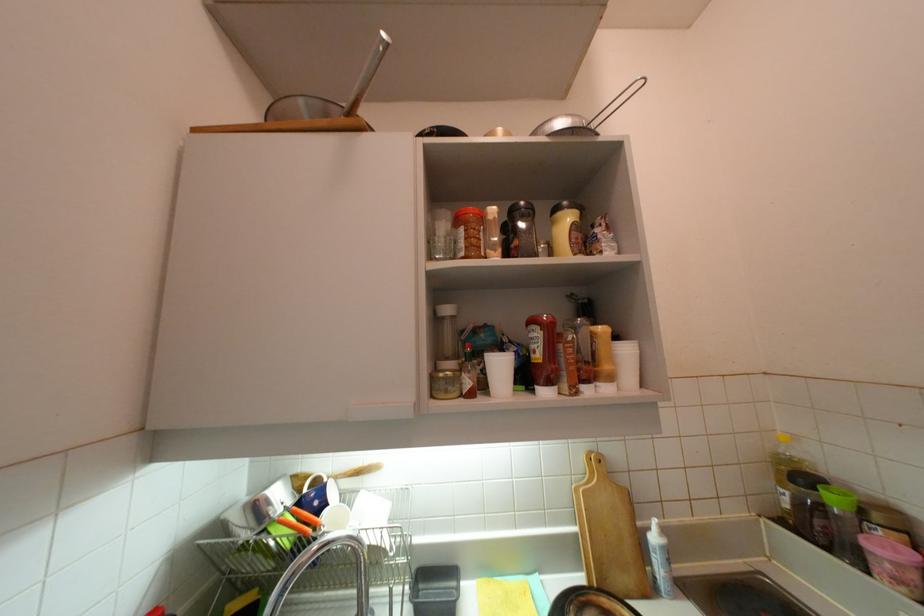
This screenshot has width=924, height=616. I want to click on wooden cutting board, so 609,532.